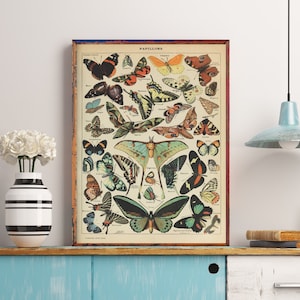
This screenshot has width=300, height=300. Find the location of `blue cabinets`. blue cabinets is located at coordinates (159, 277), (48, 281).